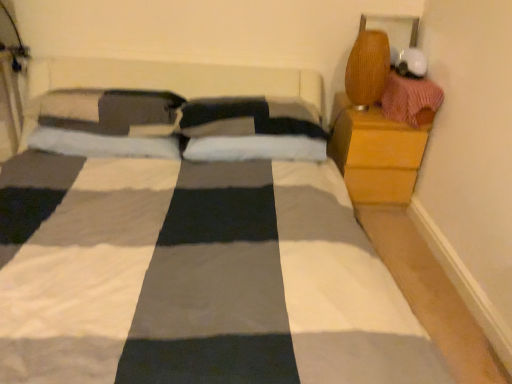
Identify the location of wooden nightstand at right. (375, 154).

This screenshot has width=512, height=384. What do you see at coordinates (375, 154) in the screenshot?
I see `wooden nightstand at right` at bounding box center [375, 154].

Locate an element on the screen. This screenshot has height=384, width=512. knitted pink sweater at upper right is located at coordinates (411, 100).

Describe the element at coordinates (411, 100) in the screenshot. I see `knitted pink sweater at upper right` at that location.

Locate an element on the screen. wooden nightstand at right is located at coordinates (375, 154).

Is knitted pink sweater at upper right to the right of wooden nightstand at right from the viewer's perspective?

Correct, you'll find knitted pink sweater at upper right to the right of wooden nightstand at right.

Which is behind, knitted pink sweater at upper right or wooden nightstand at right?

wooden nightstand at right is behind.

Is point (410, 94) closer to viewer compared to point (401, 148)?

Yes, point (410, 94) is in front of point (401, 148).

From the image's perspective, is knitted pink sweater at upper right positioned above or below wooden nightstand at right?

Based on their image positions, knitted pink sweater at upper right is located above wooden nightstand at right.

From a real-world perspective, which object rests below the other?

Result: In real-world perspective, wooden nightstand at right is lower.

From the picture: Looking at their sizes, would you say knitted pink sweater at upper right is wider or thinner than wooden nightstand at right?

Clearly, knitted pink sweater at upper right has less width compared to wooden nightstand at right.

Who is shorter, knitted pink sweater at upper right or wooden nightstand at right?

knitted pink sweater at upper right is shorter.

Which of these two, knitted pink sweater at upper right or wooden nightstand at right, is smaller?

knitted pink sweater at upper right is smaller.

Would you say knitted pink sweater at upper right is inside or outside wooden nightstand at right?

knitted pink sweater at upper right is not inside wooden nightstand at right, it's outside.

Would you consider knitted pink sweater at upper right to be distant from wooden nightstand at right?

Actually, knitted pink sweater at upper right and wooden nightstand at right are a little close together.

Is knitted pink sweater at upper right turned away from wooden nightstand at right?

No, wooden nightstand at right is not at the back of knitted pink sweater at upper right.

Locate an element on the screen. The height and width of the screenshot is (384, 512). nightstand on the left side of knitted pink sweater at upper right is located at coordinates (375, 154).

Which is more to the right, wooden nightstand at right or knitted pink sweater at upper right?

From the viewer's perspective, knitted pink sweater at upper right appears more on the right side.

Is wooden nightstand at right behind knitted pink sweater at upper right?

Yes.

Considering the positions of point (372, 200) and point (426, 80), is point (372, 200) closer or farther from the camera than point (426, 80)?

Point (372, 200) is positioned farther from the camera compared to point (426, 80).

From the image's perspective, is wooden nightstand at right above or below knitted pink sweater at upper right?

Based on their image positions, wooden nightstand at right is located beneath knitted pink sweater at upper right.

From a real-world perspective, is wooden nightstand at right positioned above or below knitted pink sweater at upper right?

From a real-world perspective, wooden nightstand at right is physically below knitted pink sweater at upper right.

Between wooden nightstand at right and knitted pink sweater at upper right, which one has larger width?

wooden nightstand at right.

Does wooden nightstand at right have a greater height compared to knitted pink sweater at upper right?

Indeed, wooden nightstand at right has a greater height compared to knitted pink sweater at upper right.

Who is smaller, wooden nightstand at right or knitted pink sweater at upper right?

Smaller between the two is knitted pink sweater at upper right.

Is knitted pink sweater at upper right surrounded by wooden nightstand at right?

No, knitted pink sweater at upper right is not surrounded by wooden nightstand at right.

Are wooden nightstand at right and knitted pink sweater at upper right located far from each other?

wooden nightstand at right is actually quite close to knitted pink sweater at upper right.

Could you tell me if wooden nightstand at right is turned towards knitted pink sweater at upper right?

No, wooden nightstand at right is not turned towards knitted pink sweater at upper right.

Measure the distance between wooden nightstand at right and knitted pink sweater at upper right.

The distance of wooden nightstand at right from knitted pink sweater at upper right is 7.89 inches.

Locate an element on the screen. This screenshot has width=512, height=384. nightstand that appears below the knitted pink sweater at upper right (from a real-world perspective) is located at coordinates (375, 154).

Locate an element on the screen. This screenshot has width=512, height=384. material lying on the right of wooden nightstand at right is located at coordinates (411, 100).

Find the location of a particular element. The width and height of the screenshot is (512, 384). nightstand lying behind the knitted pink sweater at upper right is located at coordinates (375, 154).